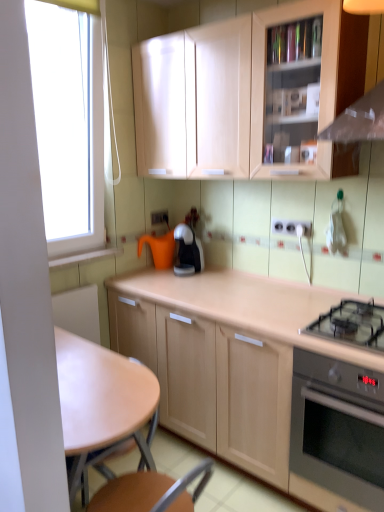
You are a GUI agent. You are given a task and a screenshot of the screen. Output one action in this format:
    pyautogui.click(x=<x>, y=<y>)
    Task: Click on the spots to the right of black glossy coffee maker at center
    This screenshot has height=512, width=384.
    Given the screenshot: What is the action you would take?
    pyautogui.click(x=221, y=272)